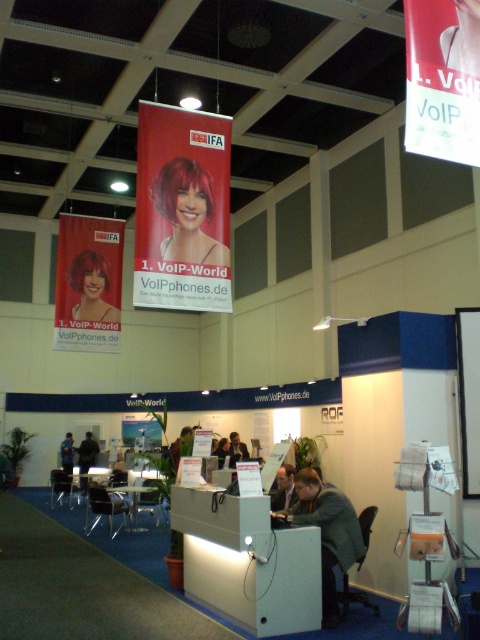
Question: Which point is farther from the camera taking this photo?

Choices:
 (A) (312, 481)
 (B) (183, 131)
 (C) (94, 296)

Answer: (C)

Question: Where is shiny red hair at center located in relation to dark gray fabric jacket at center in the image?

Choices:
 (A) below
 (B) above

Answer: (B)

Question: Which of the following is the farthest from the observer?

Choices:
 (A) dark gray fabric jacket at center
 (B) matte red hair at upper left
 (C) matte red banner at upper center
 (D) matte red banner at upper left

Answer: (B)

Question: Does shiny red hair at center come in front of dark gray fabric jacket at center?

Choices:
 (A) yes
 (B) no

Answer: (B)

Question: Does matte red banner at upper left appear over matte red hair at upper left?

Choices:
 (A) no
 (B) yes

Answer: (B)

Question: Which point is farther from the camera taking this photo?

Choices:
 (A) (464, 484)
 (B) (177, 163)
 (C) (418, 42)
 (D) (68, 461)

Answer: (D)